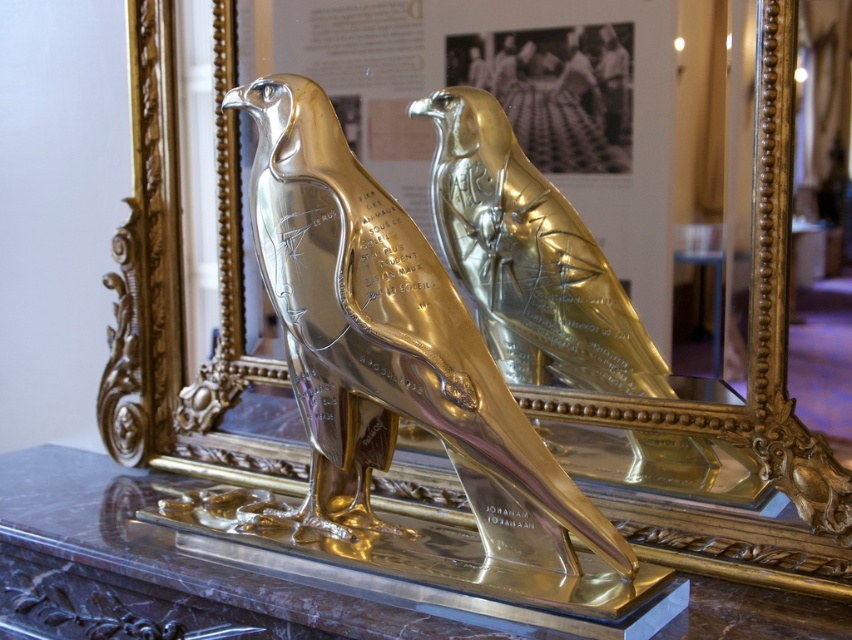
You are standing in front of the golden sculpture of two birds and want to take a photo. You notice two points marked in the scene at coordinates point (355, 180) and point (515, 304). Which point is closer to your current position?

Point (355, 180) is closer to the camera than point (515, 304), so the point at (355, 180) is closer to your current position.

You are standing in front of the golden sculpture of two birds. You want to touch the shiny gold bird at center and the gold polished eagle at center. Which one can you reach first without moving your position?

The shiny gold bird at center is closer to the viewer than the gold polished eagle at center, so you can reach it first without moving.